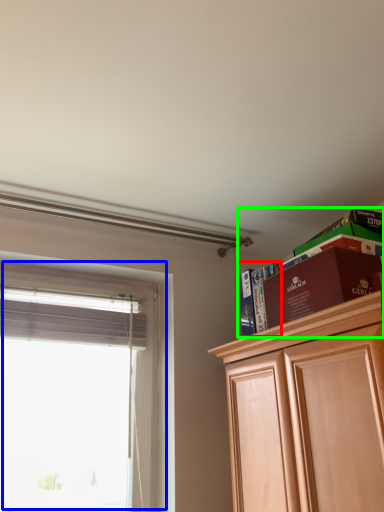
Question: Which is farther away from book (highlighted by a red box)? window (highlighted by a blue box) or shelf (highlighted by a green box)?

Choices:
 (A) window
 (B) shelf

Answer: (A)